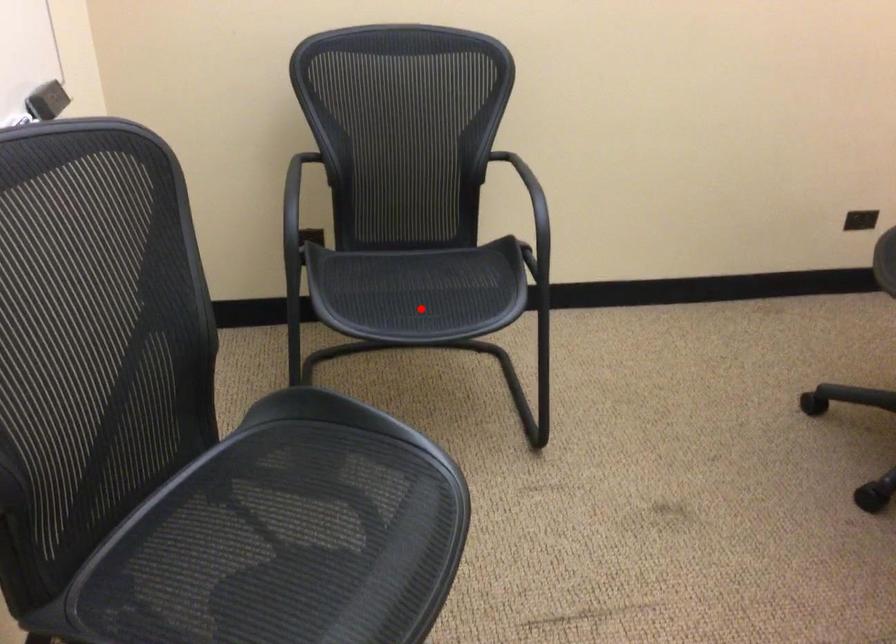
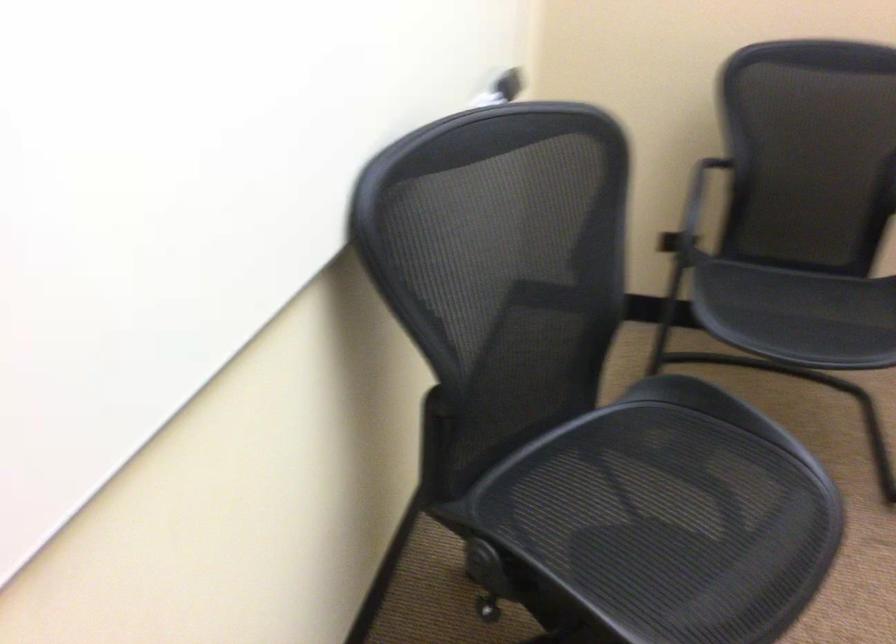
In the second image, find the point that corresponds to the highlighted location in the first image.

(798, 315)